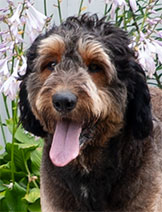
The height and width of the screenshot is (212, 162). In order to click on wall in this screenshot , I will do `click(70, 7)`.